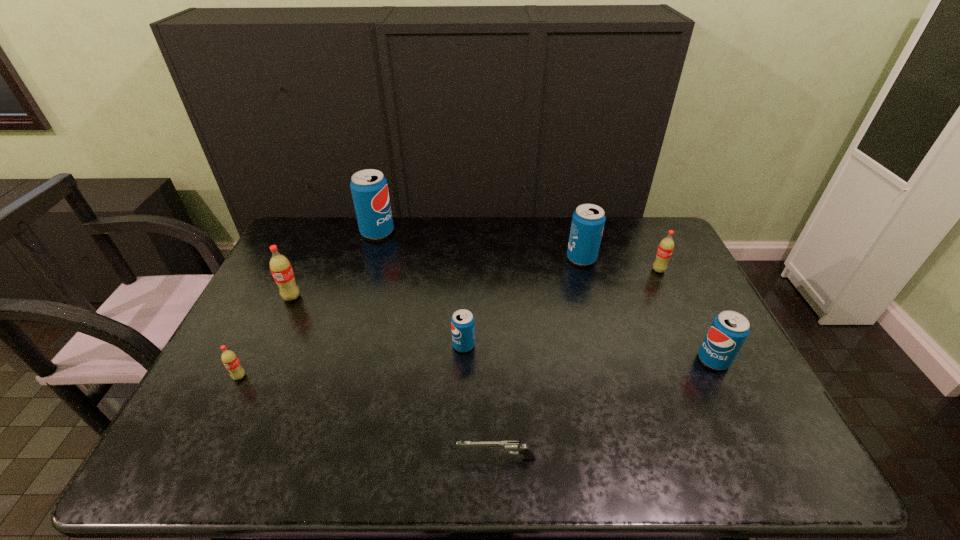
The width and height of the screenshot is (960, 540). What are the coordinates of `object that is the seventh closest to the shortest object` in the screenshot? It's located at (369, 188).

The width and height of the screenshot is (960, 540). What are the coordinates of `the second closest object to the smallest red soda` in the screenshot? It's located at (462, 322).

Where is `soda that stands as the fourth closest to the pistol`? The height and width of the screenshot is (540, 960). soda that stands as the fourth closest to the pistol is located at coordinates (588, 220).

Identify the location of soda that is the fourth closest to the third soda from right to left. This screenshot has height=540, width=960. (369, 188).

Locate an element on the screen. the second closest blue soda can to the rightmost red soda is located at coordinates (729, 329).

The image size is (960, 540). What are the coordinates of `the closest blue soda can relative to the smallest red soda` in the screenshot? It's located at (462, 322).

Identify the location of the closest red soda to the fourth farthest soda. Image resolution: width=960 pixels, height=540 pixels. (229, 358).

Select which red soda is the closest to the tallest object. Please provide its 2D coordinates. Your answer should be formatted as a tuple, i.e. [(x, y)], where the tuple contains the x and y coordinates of a point satisfying the conditions above.

[(280, 267)]